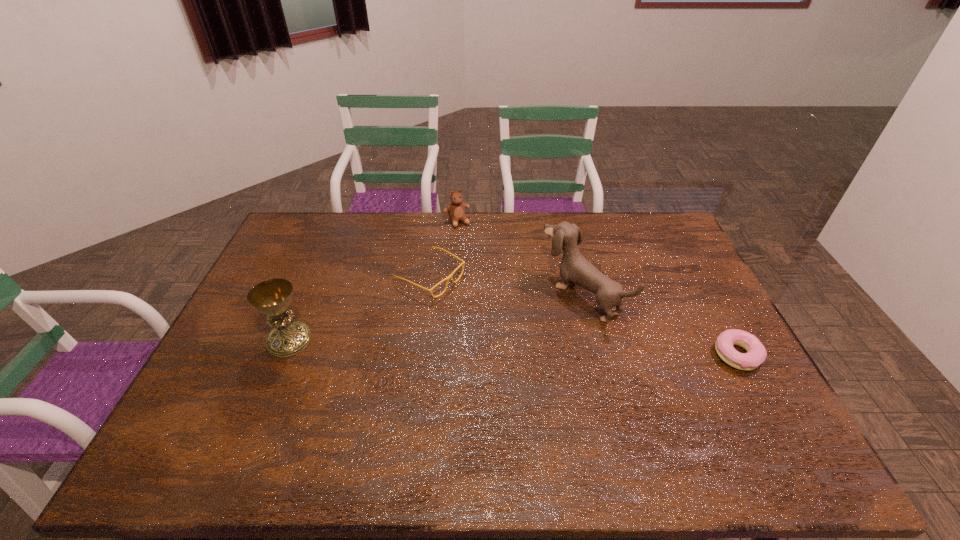
You are a GUI agent. You are given a task and a screenshot of the screen. Output one action in this format:
    pyautogui.click(x=<x>, y=<y>)
    Task: Click on the vacant space situated in front of the lenses of the spectacles
    The width and height of the screenshot is (960, 540).
    Given the screenshot: What is the action you would take?
    pyautogui.click(x=529, y=330)

Find the location of a particular element. The height and width of the screenshot is (540, 960). vacant space situated at the face of the puppy is located at coordinates (519, 338).

Image resolution: width=960 pixels, height=540 pixels. Identify the location of blank space located 0.300m at the face of the puppy. (474, 366).

You are a GUI agent. You are given a task and a screenshot of the screen. Output one action in this format:
    pyautogui.click(x=<x>, y=<y>)
    Task: Click on the vacant position located 0.400m at the face of the puppy
    The image size is (960, 540).
    Given the screenshot: What is the action you would take?
    point(444,384)

You are a GUI agent. You are given a task and a screenshot of the screen. Output one action in this format:
    pyautogui.click(x=<x>, y=<y>)
    Task: Click on the vacant region located 0.330m on the front-facing side of the third shortest object
    This screenshot has height=540, width=960.
    Given the screenshot: What is the action you would take?
    pyautogui.click(x=494, y=284)

This screenshot has width=960, height=540. I want to click on free space located 0.300m on the front-facing side of the third shortest object, so click(x=491, y=278).

Locate an element on the screen. vacant point located 0.200m on the front-facing side of the third shortest object is located at coordinates (480, 260).

Locate an element on the screen. object that is at the far edge is located at coordinates pyautogui.click(x=456, y=210).

Locate an element on the screen. The image size is (960, 540). object at the left edge is located at coordinates (272, 297).

Locate an element on the screen. The image size is (960, 540). object situated at the right edge is located at coordinates (756, 354).